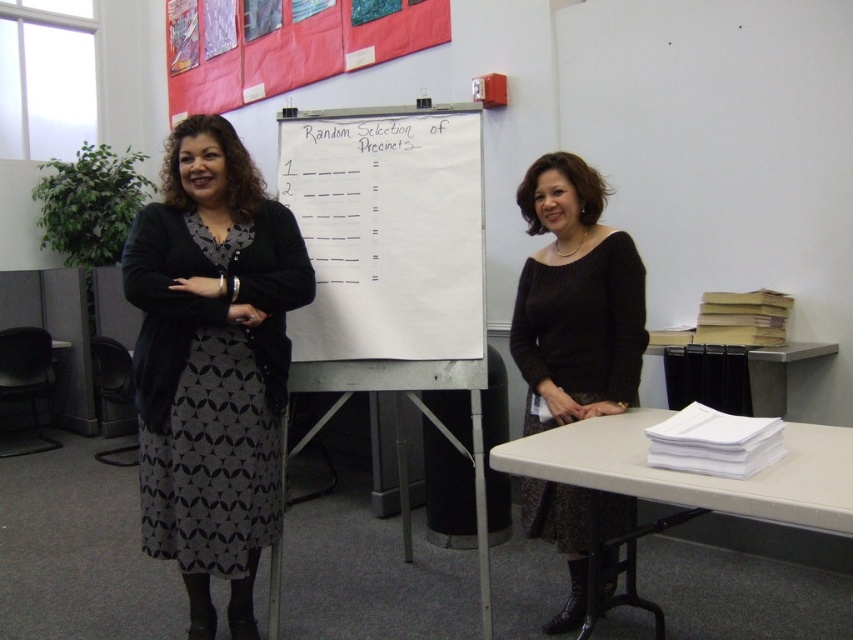
You are a photographer trying to capture a closeup of the whiteboard in the classroom. You notice two points marked on the whiteboard at coordinates point (639, 262) and point (819, 432). Which point should you focus on to ensure it appears larger in your photo?

Point (639, 262) is further to the camera than point (819, 432), so focusing on point (639, 262) will make it appear larger in the photo.

You are a student entering the classroom and see the white plastic table at lower right and the white paper at right. Which object is closer to you as you enter?

The white plastic table at lower right is closer to you because it is in front of the white paper at right.